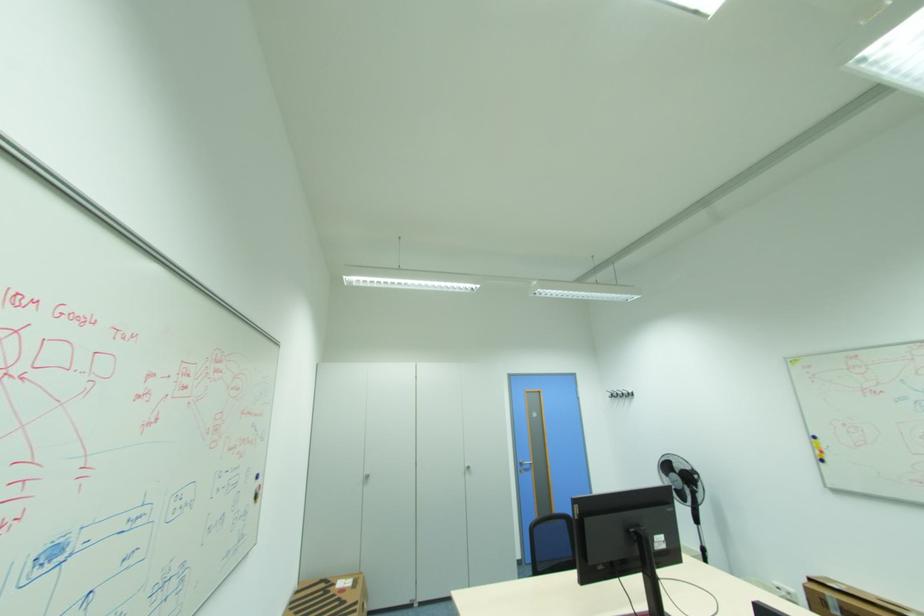
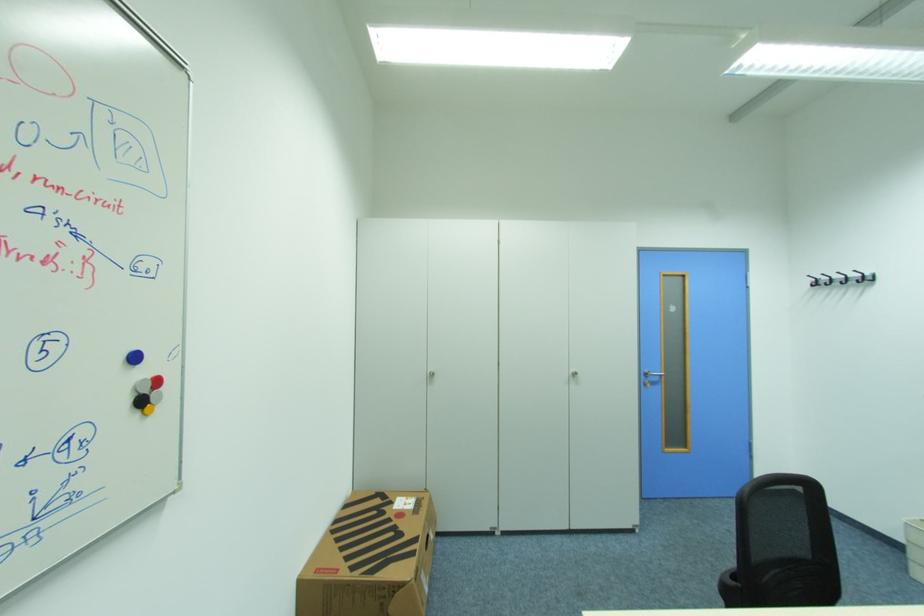
In the second image, find the point that corresponds to [338,585] in the first image.

(396, 503)